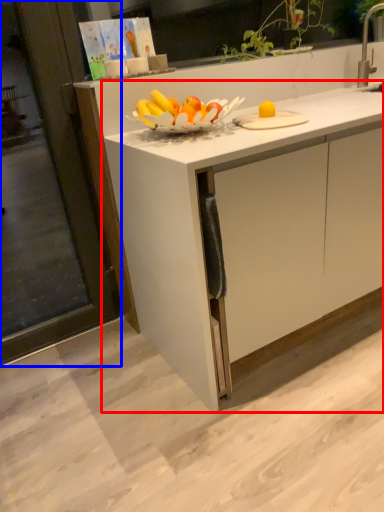
Question: Which object appears farthest to the camera in this image, cabinetry (highlighted by a red box) or screen door (highlighted by a blue box)?

Choices:
 (A) cabinetry
 (B) screen door

Answer: (B)